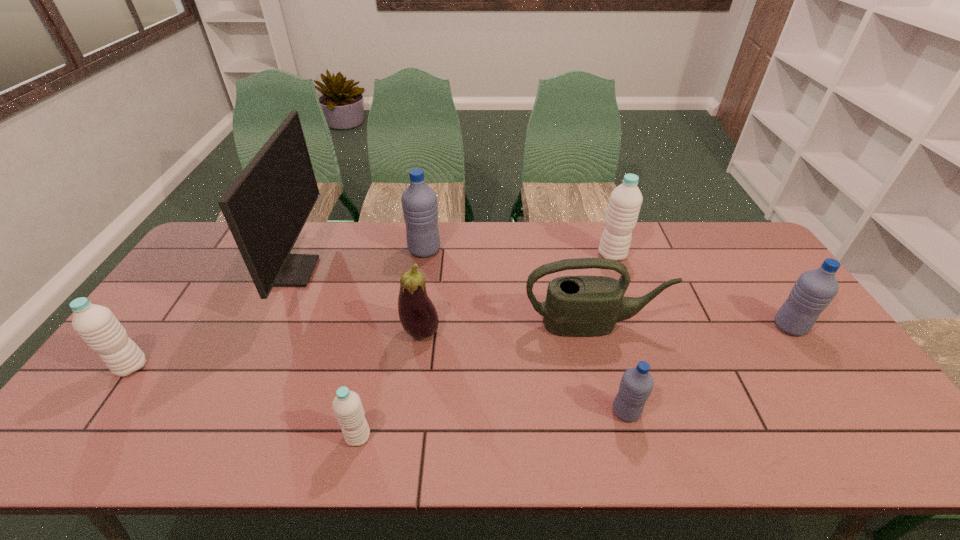
Where is `free location that satisfies the following two spatial constraints: 1. on the front-facing side of the tallest object; 2. on the left side of the second blue water bottle from right to left`? Image resolution: width=960 pixels, height=540 pixels. free location that satisfies the following two spatial constraints: 1. on the front-facing side of the tallest object; 2. on the left side of the second blue water bottle from right to left is located at coordinates (228, 411).

The height and width of the screenshot is (540, 960). Find the location of `blank space that satisfies the following two spatial constraints: 1. on the spout of the watering can; 2. on the left side of the third water bottle from right to left`. blank space that satisfies the following two spatial constraints: 1. on the spout of the watering can; 2. on the left side of the third water bottle from right to left is located at coordinates click(x=615, y=411).

The height and width of the screenshot is (540, 960). What are the coordinates of `blank space that satisfies the following two spatial constraints: 1. on the back side of the second biggest blue water bottle; 2. on the front-facing side of the eighth object from right to left` in the screenshot? It's located at (752, 272).